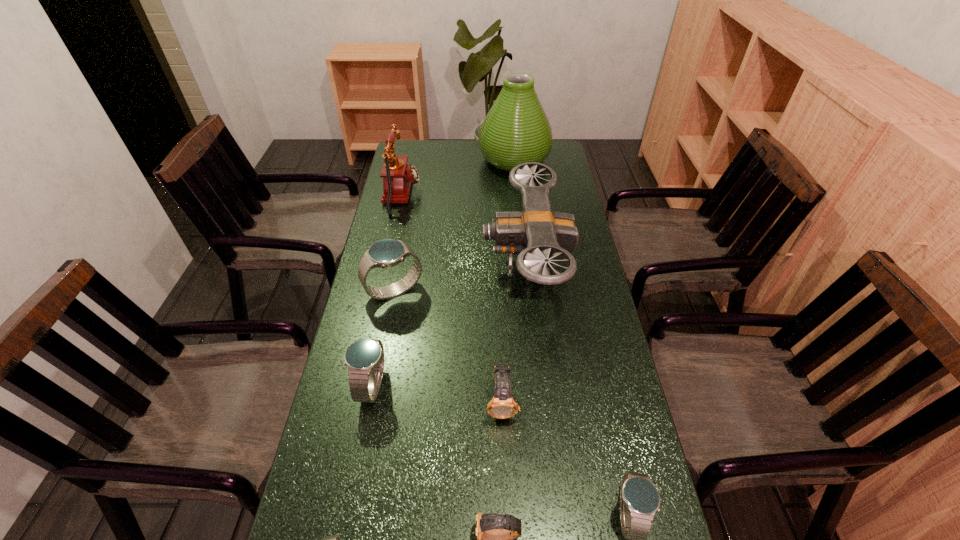
Find the location of a particular element. This screenshot has width=960, height=540. object that is at the far right corner is located at coordinates (516, 130).

Locate an element on the screen. This screenshot has height=540, width=960. vacant space at the left edge of the desktop is located at coordinates (397, 218).

You are a GUI agent. You are given a task and a screenshot of the screen. Output one action in this format:
    pyautogui.click(x=<x>, y=<y>)
    Task: Click on the free space at the right edge of the desktop
    The image size is (960, 540).
    Given the screenshot: What is the action you would take?
    coord(566,180)

Locate an element on the screen. Image resolution: width=960 pixels, height=540 pixels. free spot between the farthest blue watch and the second farthest blue watch is located at coordinates (383, 338).

The height and width of the screenshot is (540, 960). What are the coordinates of `blank region between the third smallest blue watch and the yellow drone` in the screenshot? It's located at (449, 325).

Locate an element on the screen. This screenshot has height=540, width=960. vacant region between the drone and the telephone is located at coordinates (465, 229).

At what (x,y) coordinates should I click in order to perform the action: click on the seventh closest object relative to the tallest watch. Please return your answer as a coordinate pair (x, y). The image size is (960, 540). Looking at the image, I should click on (334, 539).

Locate which object is the closest to the tallest object. Please provide its 2D coordinates. Your answer should be formatted as a tuple, i.e. [(x, y)], where the tuple contains the x and y coordinates of a point satisfying the conditions above.

[(535, 233)]

Locate which watch is the sixth closest to the yellow drone. Please provide its 2D coordinates. Your answer should be formatted as a tuple, i.e. [(x, y)], where the tuple contains the x and y coordinates of a point satisfying the conditions above.

[(334, 539)]

Select which watch is the closest to the third nearest blue watch. Please provide its 2D coordinates. Your answer should be formatted as a tuple, i.e. [(x, y)], where the tuple contains the x and y coordinates of a point satisfying the conditions above.

[(385, 253)]